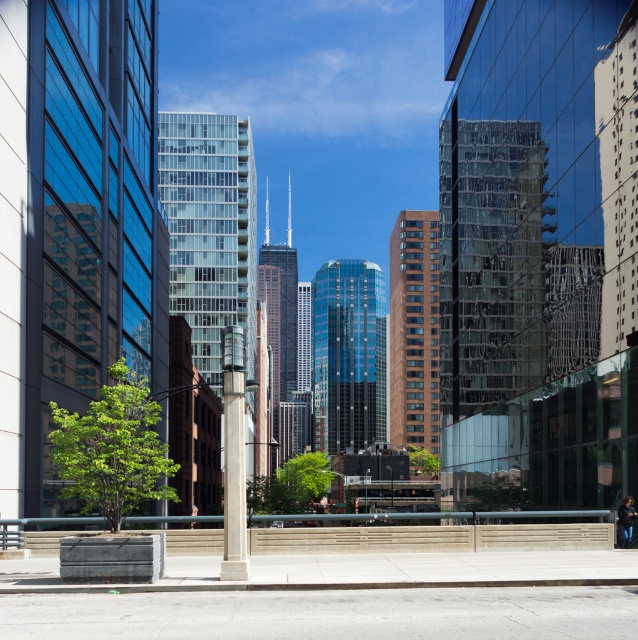
You are an urban planner assessing the space between the shiny glass skyscraper at center and the brown brick building at center. Which building occupies more area in the image?

The shiny glass skyscraper at center has a larger size compared to the brown brick building at center, so it occupies more area in the image.

Based on the coordinates provided, which object in the scene is located at point (346, 355)?

Answer: The shiny glass skyscraper at center is located at point (346, 355).

Consider the image. You are a drone operator trying to capture a photo of both the shiny glass skyscraper at center and the brown glass skyscraper at center. Since you can only focus on one building at a time, which one should you adjust your camera to focus on first to ensure the other is still visible in the background?

You should focus on the shiny glass skyscraper at center first because it is in front of the brown glass skyscraper at center, so if you focus on the shiny one, the brown one will naturally be in the background and still visible.